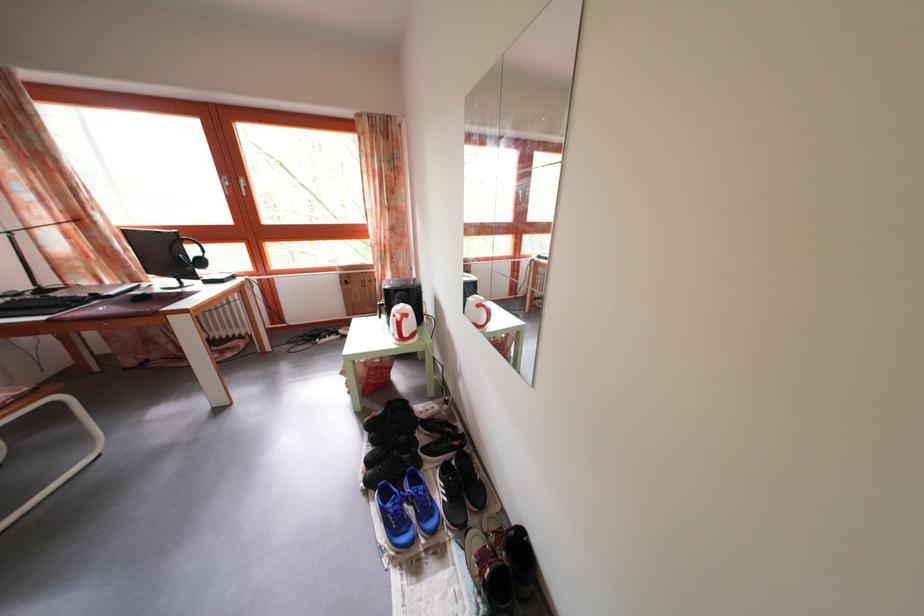
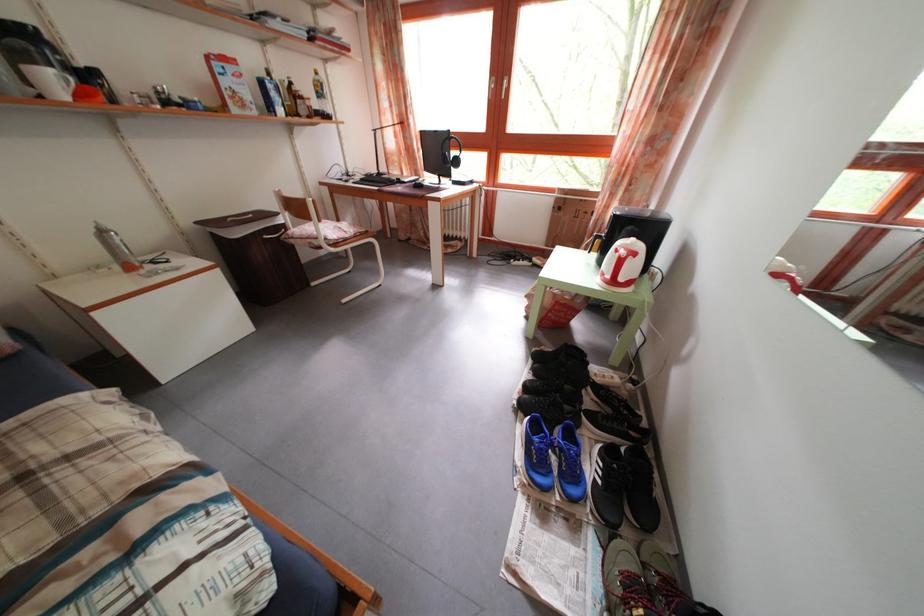
Locate, in the second image, the point that corresponds to [422,487] in the first image.

(578, 444)